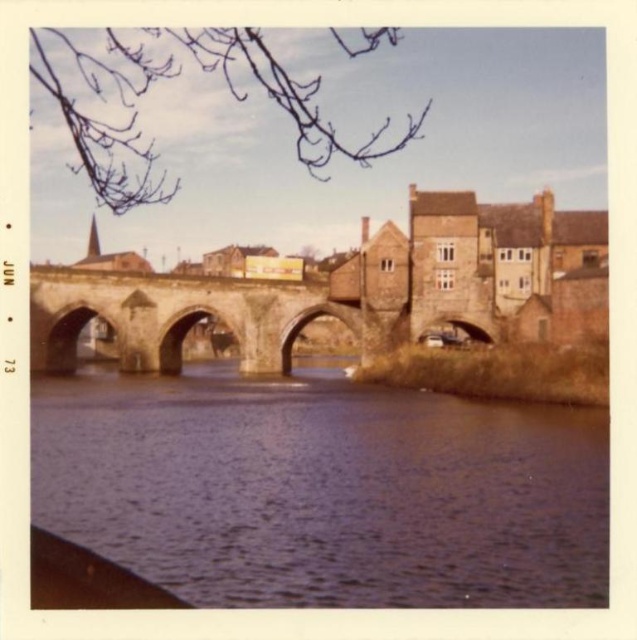
You are standing on the stone bridge and looking towards the river. There are two points marked on the bridge deck. The first point is at coordinates point (148, 452) and the second point is at point (164, 348). Which point is closer to you as you face the river?

Point (148, 452) is closer to the viewer than point (164, 348).